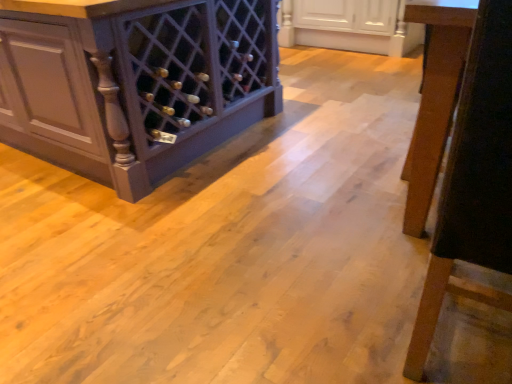
Locate an element on the screen. This screenshot has height=384, width=512. free spot to the left of wooden chair leg at right is located at coordinates (307, 317).